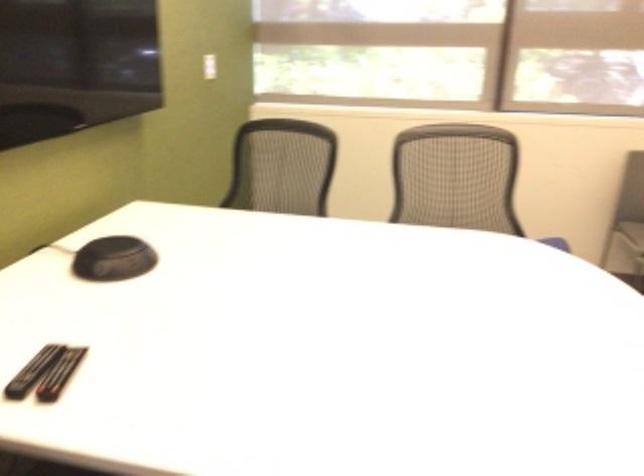
What do you see at coordinates (209, 66) in the screenshot? I see `the white wall switch` at bounding box center [209, 66].